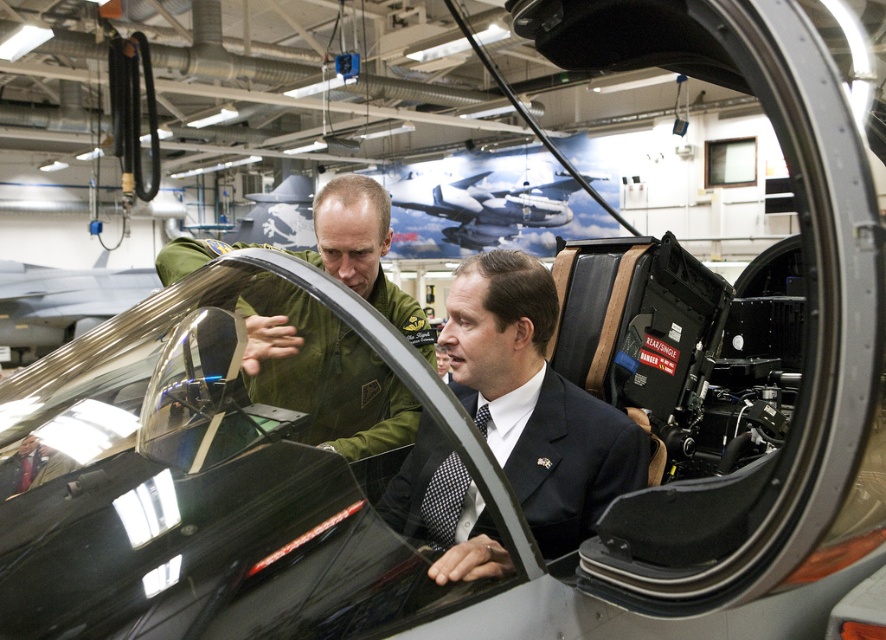
You are a maintenance worker in the aircraft hangar. You need to locate the dark green uniform at center. According to the coordinates provided, where exactly would you find it?

The dark green uniform at center is located at the coordinates point (535, 401).

You are a safety inspector in the aircraft hangar. You need to access the warning label on the metallic silver aircraft at center. Given that the green uniform at center is blocking your direct path, can you walk around it to reach the label?

The green uniform at center is below the metallic silver aircraft at center, so you can walk around the green uniform at center to access the warning label on the metallic silver aircraft at center.

You are a technician in the aircraft hangar. You need to locate the dark green uniform at center. Where would you find it in the image?

The dark green uniform at center is located at the coordinates point (535, 401) in the image.